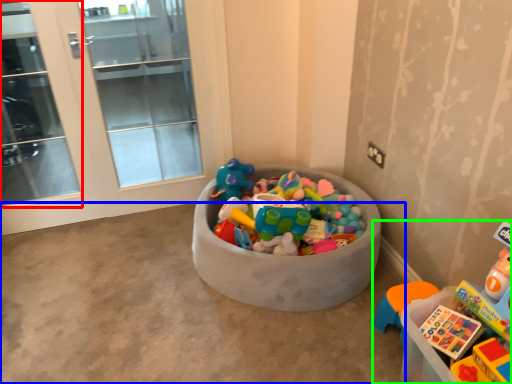
Question: Estimate the real-world distances between objects in this image. Which object is closer to screen door (highlighted by a red box), concrete (highlighted by a blue box) or toy (highlighted by a green box)?

Choices:
 (A) concrete
 (B) toy

Answer: (A)